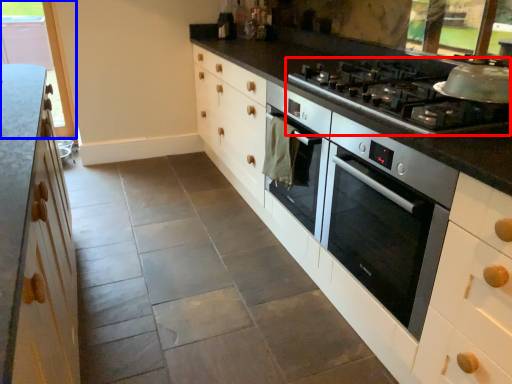
Question: Which object appears closest to the camera in this image, gas stove (highlighted by a red box) or window (highlighted by a blue box)?

Choices:
 (A) gas stove
 (B) window

Answer: (A)